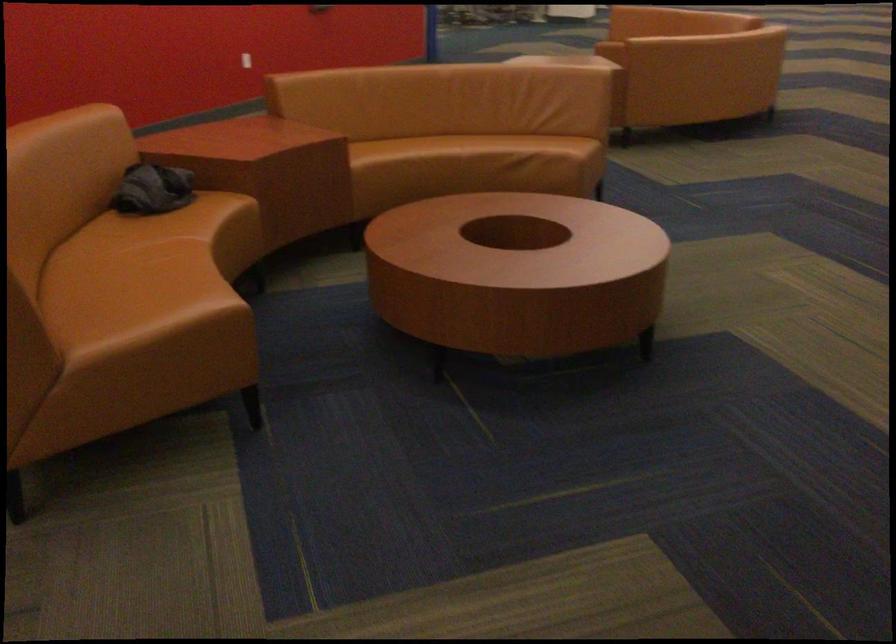
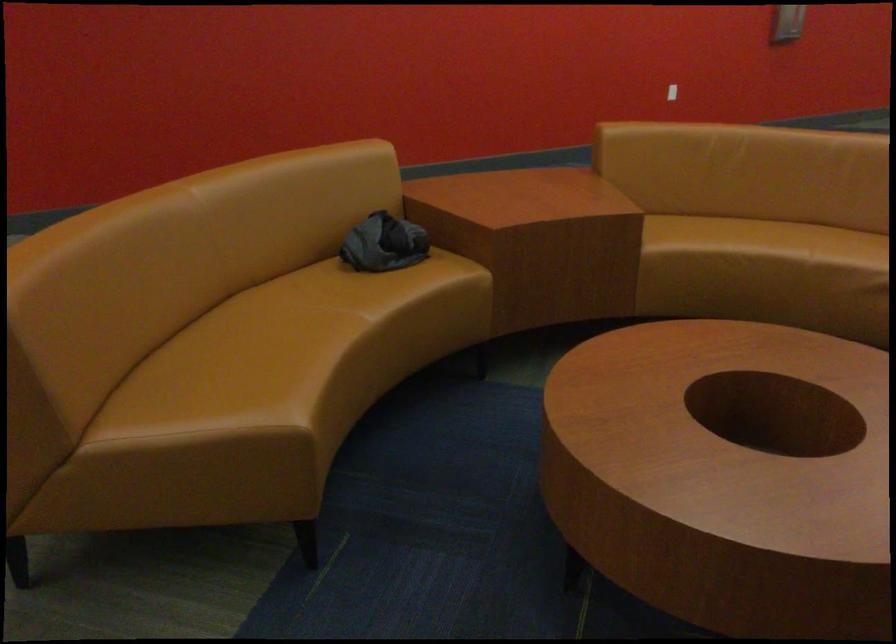
Where in the second image is the point corresponding to pixel 126 270 from the first image?

(271, 336)